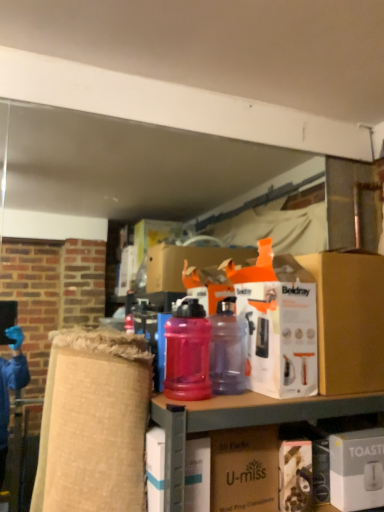
Identify the location of free space above white matte toaster at lower right, which is the first box from right to left (from a real-world perspective). Image resolution: width=384 pixels, height=512 pixels. (359, 432).